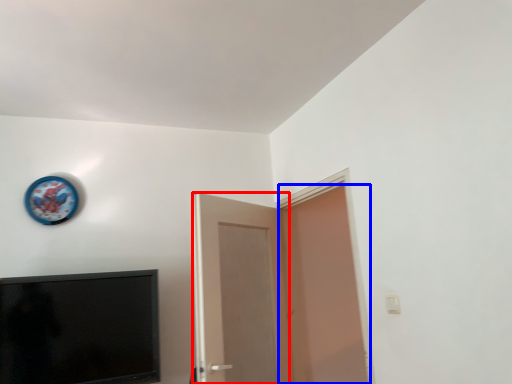
Question: Which point is closer to the camera, door (highlighted by a red box) or door (highlighted by a blue box)?

Choices:
 (A) door
 (B) door

Answer: (B)